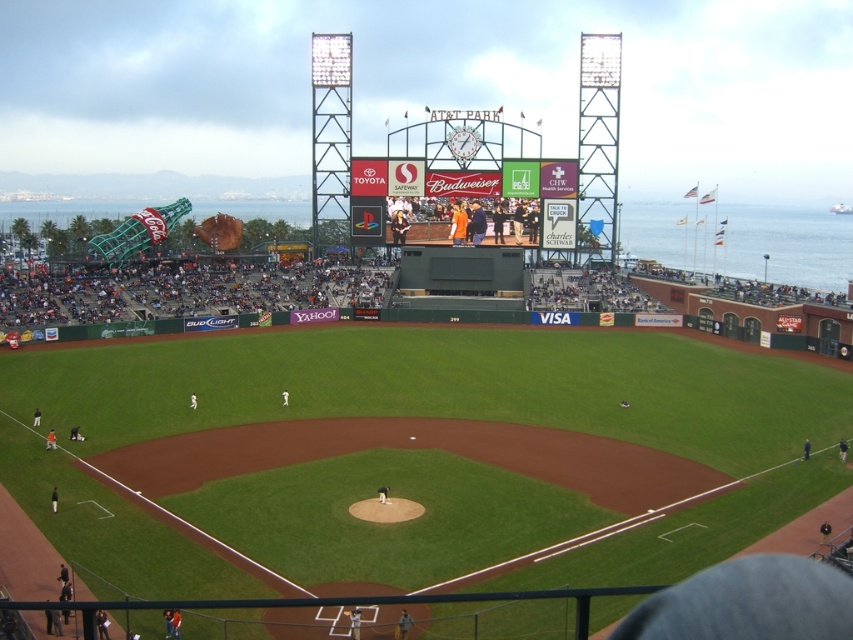
Based on the photo, is green grass at center above matte digital screen at center?

Incorrect, green grass at center is not positioned above matte digital screen at center.

Does point (828, 484) come in front of point (363, 168)?

Yes, it is in front of point (363, 168).

Is point (685, 432) farther from camera compared to point (351, 164)?

No, it is not.

This screenshot has width=853, height=640. Identify the location of green grass at center. (428, 416).

From the picture: Can you confirm if green grass at center is taller than orange jersey at center?

Indeed, green grass at center has a greater height compared to orange jersey at center.

Does green grass at center have a lesser height compared to orange jersey at center?

In fact, green grass at center may be taller than orange jersey at center.

Who is more forward, (834, 456) or (460, 220)?

Point (834, 456) is more forward.

The image size is (853, 640). Identify the location of green grass at center. (428, 416).

Who is positioned more to the left, matte digital screen at center or orange jersey at center?

From the viewer's perspective, orange jersey at center appears more on the left side.

Which is behind, point (488, 193) or point (444, 208)?

The point (488, 193) is behind.

Find the location of `matte digital screen at center`. matte digital screen at center is located at coordinates (416, 179).